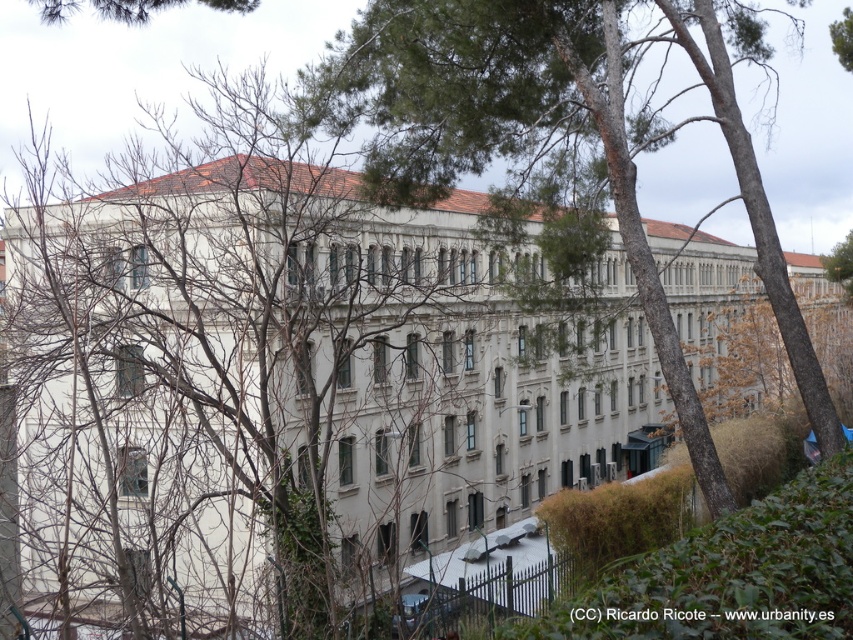
You are an architect analyzing the building in the image. You notice two trees in the scene. Which tree, the bare branches at center or the green leafy tree at upper right, is closer to the building?

The bare branches at center is closer to the building because it appears bigger than the green leafy tree at upper right, which is farther away and thus smaller in the image.